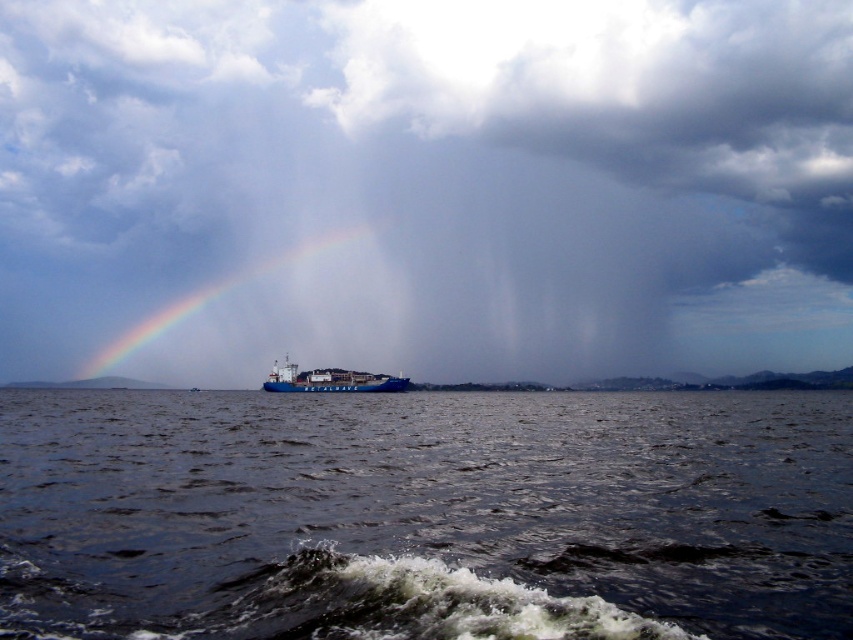
Can you confirm if cloudy textured sky at center is taller than rainbow at center?

Yes, cloudy textured sky at center is taller than rainbow at center.

Who is taller, cloudy textured sky at center or rainbow at center?

Standing taller between the two is cloudy textured sky at center.

Which is behind, point (780, 17) or point (167, 308)?

The point (780, 17) is behind.

Find the location of a particular element. cloudy textured sky at center is located at coordinates (424, 188).

Who is positioned more to the right, rainbow at center or blue matte cargo ship at center?

From the viewer's perspective, blue matte cargo ship at center appears more on the right side.

What do you see at coordinates (213, 296) in the screenshot? This screenshot has height=640, width=853. I see `rainbow at center` at bounding box center [213, 296].

At what (x,y) coordinates should I click in order to perform the action: click on rainbow at center. Please return your answer as a coordinate pair (x, y). This screenshot has width=853, height=640. Looking at the image, I should click on [x=213, y=296].

Is cloudy textured sky at center bigger than blue matte cargo ship at center?

Yes, cloudy textured sky at center is bigger than blue matte cargo ship at center.

Based on the photo, can you confirm if cloudy textured sky at center is thinner than blue matte cargo ship at center?

In fact, cloudy textured sky at center might be wider than blue matte cargo ship at center.

What do you see at coordinates (424, 188) in the screenshot? The image size is (853, 640). I see `cloudy textured sky at center` at bounding box center [424, 188].

At what (x,y) coordinates should I click in order to perform the action: click on cloudy textured sky at center. Please return your answer as a coordinate pair (x, y). This screenshot has width=853, height=640. Looking at the image, I should click on (424, 188).